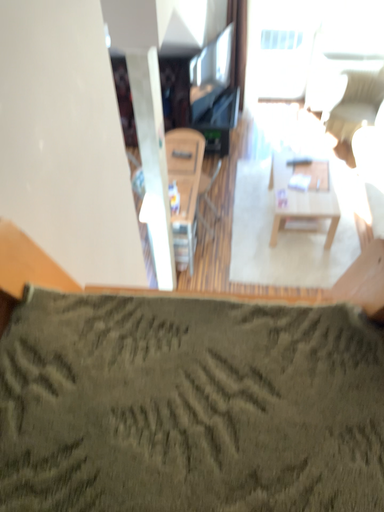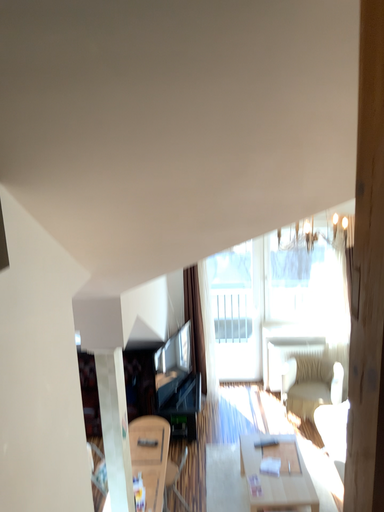
Question: Which way did the camera rotate in the video?

Choices:
 (A) rotated upward
 (B) rotated downward

Answer: (A)